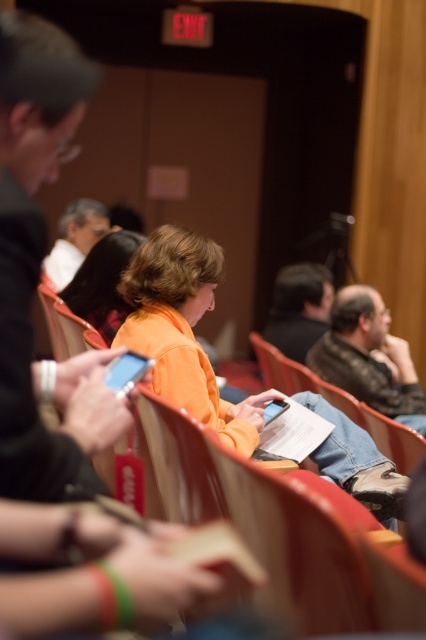
Which of these two, orange matte jacket at center or matte white shirt at center, stands taller?

With more height is orange matte jacket at center.

Does orange matte jacket at center have a lesser width compared to matte white shirt at center?

In fact, orange matte jacket at center might be wider than matte white shirt at center.

What do you see at coordinates (184, 330) in the screenshot? I see `orange matte jacket at center` at bounding box center [184, 330].

At what (x,y) coordinates should I click in order to perform the action: click on orange matte jacket at center. Please return your answer as a coordinate pair (x, y). This screenshot has width=426, height=640. Looking at the image, I should click on (184, 330).

Who is shorter, dark brown leather jacket at center or matte white shirt at center?

Standing shorter between the two is dark brown leather jacket at center.

Who is lower down, dark brown leather jacket at center or matte white shirt at center?

dark brown leather jacket at center is below.

Does point (339, 301) come closer to viewer compared to point (80, 221)?

Yes, it is.

Where is `dark brown leather jacket at center`? dark brown leather jacket at center is located at coordinates (368, 356).

Where is `dark brown leather jacket at center`? dark brown leather jacket at center is located at coordinates (368, 356).

Which is more to the right, dark brown leather jacket at center or orange matte shirt at center?

From the viewer's perspective, dark brown leather jacket at center appears more on the right side.

Is point (359, 324) farther from viewer compared to point (112, 244)?

Yes, point (359, 324) is farther from viewer.

At what (x,y) coordinates should I click in order to perform the action: click on dark brown leather jacket at center. Please return your answer as a coordinate pair (x, y). The image size is (426, 640). Looking at the image, I should click on (368, 356).